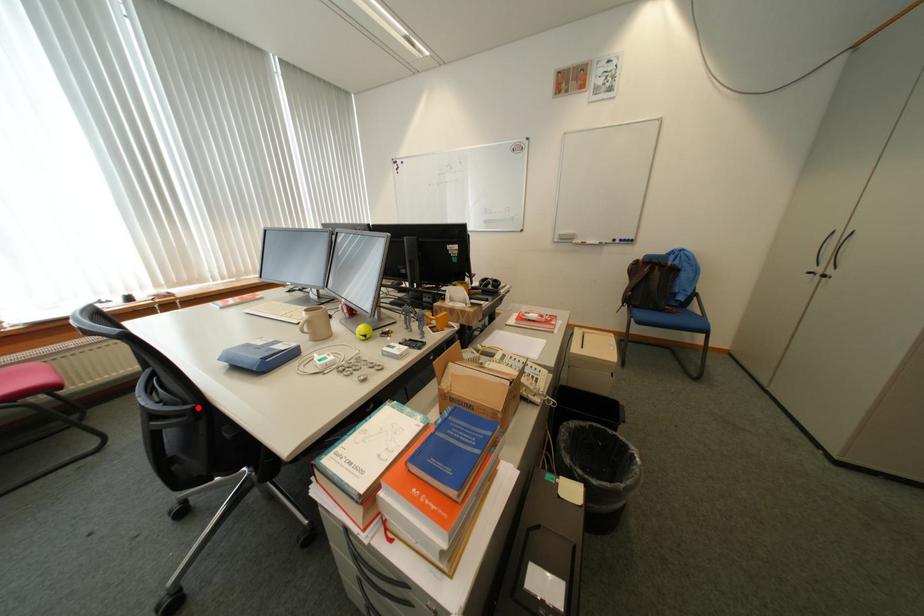
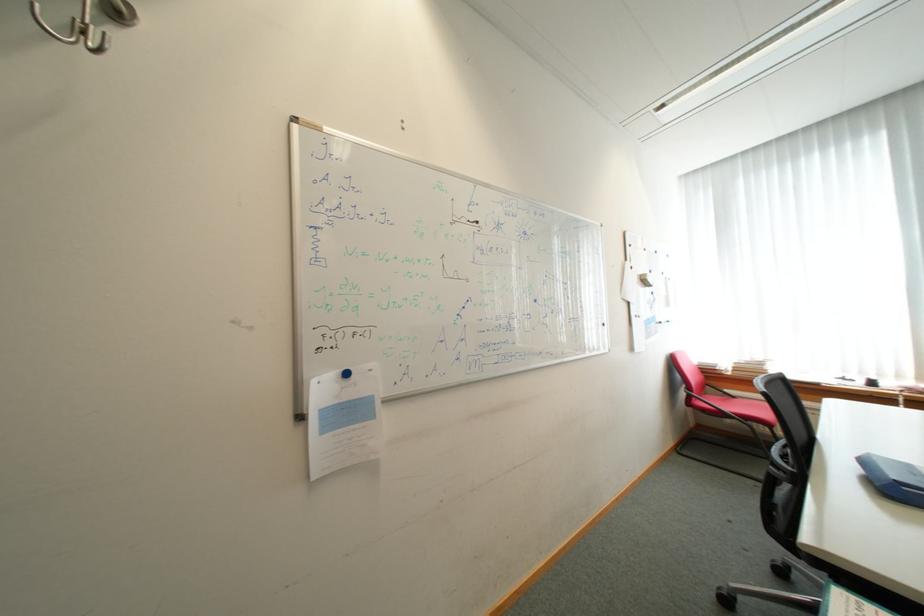
Where in the second image is the point corresponding to the highlighted location from the first image?

(800, 469)